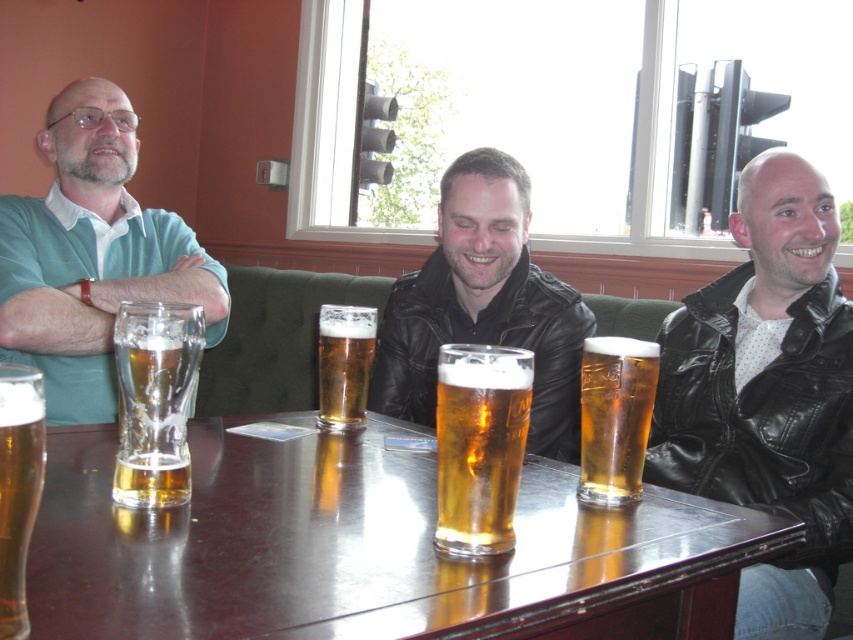
You are standing at the entrance of the pub and notice two men sitting at the table. One is wearing a teal shirt with a white collar, and the other is wearing a black leather jacket at right. If you want to join their conversation, which direction should you walk towards?

You should walk towards the black leather jacket at right because it is located at point 0.614 on the horizontal axis, which is to the right side of the table, so moving in that direction would place you near the men.

You are a bartender who needs to restock the glasses. You see the translucent glass mug at lower left and the translucent glass beer at table left. Which one is positioned higher up?

The translucent glass mug at lower left is located above the translucent glass beer at table left, so it is positioned higher up.